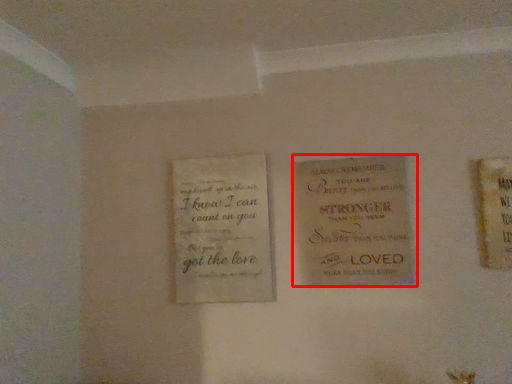
Question: From the image's perspective, what is the correct spatial positioning of book (annotated by the red box) in reference to book?

Choices:
 (A) above
 (B) below

Answer: (A)